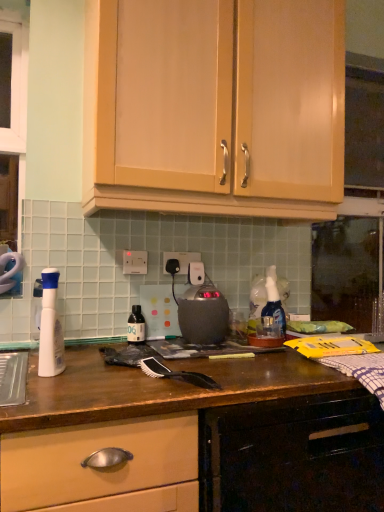
Question: In which direction should I rotate to look at white plastic electric outlet at center, positioned as the 2th electric outlet in right-to-left order?

Choices:
 (A) right
 (B) left

Answer: (B)

Question: Does satin black kettle at center have a greater width compared to black plastic electric outlet at center, which is the first electric outlet from back to front?

Choices:
 (A) no
 (B) yes

Answer: (B)

Question: Does satin black kettle at center have a larger size compared to black plastic electric outlet at center, which is the first electric outlet from back to front?

Choices:
 (A) yes
 (B) no

Answer: (A)

Question: Is satin black kettle at center in front of black plastic electric outlet at center, which is the first electric outlet from back to front?

Choices:
 (A) yes
 (B) no

Answer: (A)

Question: From a real-world perspective, is satin black kettle at center under black plastic electric outlet at center, which appears as the 1th electric outlet when viewed from the right?

Choices:
 (A) no
 (B) yes

Answer: (B)

Question: Can you confirm if satin black kettle at center is smaller than black plastic electric outlet at center, which appears as the 1th electric outlet when viewed from the right?

Choices:
 (A) no
 (B) yes

Answer: (A)

Question: Is satin black kettle at center to the left of black plastic electric outlet at center, which is the second electric outlet in left-to-right order, from the viewer's perspective?

Choices:
 (A) yes
 (B) no

Answer: (B)

Question: Would you consider translucent plastic bottle at center to be distant from satin black kettle at center?

Choices:
 (A) yes
 (B) no

Answer: (B)

Question: Considering the relative positions of translucent plastic bottle at center and satin black kettle at center in the image provided, is translucent plastic bottle at center behind satin black kettle at center?

Choices:
 (A) no
 (B) yes

Answer: (B)

Question: Is translucent plastic bottle at center surrounding satin black kettle at center?

Choices:
 (A) no
 (B) yes

Answer: (A)

Question: Is translucent plastic bottle at center placed right next to satin black kettle at center?

Choices:
 (A) no
 (B) yes

Answer: (A)

Question: Is translucent plastic bottle at center in front of satin black kettle at center?

Choices:
 (A) yes
 (B) no

Answer: (B)

Question: Considering the relative sizes of translucent plastic bottle at center and satin black kettle at center in the image provided, is translucent plastic bottle at center shorter than satin black kettle at center?

Choices:
 (A) no
 (B) yes

Answer: (B)

Question: Is black synthetic brush at center at the back of wooden drawer at lower left, the 1th cabinetry when ordered from bottom to top?

Choices:
 (A) no
 (B) yes

Answer: (A)